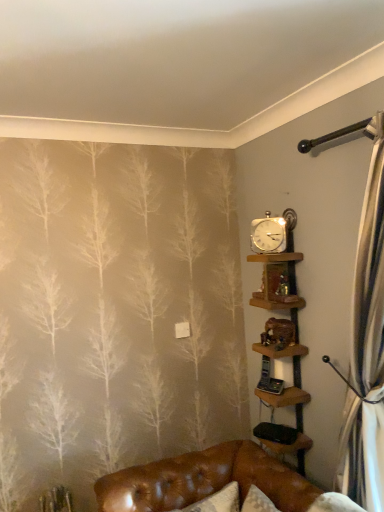
Measure the distance between point (277, 298) and camera.

A distance of 6.87 feet exists between point (277, 298) and camera.

Identify the location of wooden shelf at upper center, which appears as the 1th shelf when viewed from the top. The image size is (384, 512). (277, 281).

You are a GUI agent. You are given a task and a screenshot of the screen. Output one action in this format:
    pyautogui.click(x=<x>, y=<y>)
    Task: Click on the wooden shelves at upper right, the 1th shelf in the bottom-to-top sequence
    This screenshot has width=384, height=512.
    Given the screenshot: What is the action you would take?
    pyautogui.click(x=280, y=334)

You are a GUI agent. You are given a task and a screenshot of the screen. Output one action in this format:
    pyautogui.click(x=<x>, y=<y>)
    Task: Click on the 1st shelf positioned below the gold metallic clock at upper right (from the image's perspective)
    
    Given the screenshot: What is the action you would take?
    pyautogui.click(x=277, y=281)

Which object is further away from the camera taking this photo, gold metallic clock at upper right or wooden shelf at upper center, which appears as the 1th shelf when viewed from the top?

gold metallic clock at upper right is more distant.

Can you confirm if gold metallic clock at upper right is wider than wooden shelf at upper center, marked as the 2th shelf in a bottom-to-top arrangement?

Incorrect, the width of gold metallic clock at upper right does not surpass that of wooden shelf at upper center, marked as the 2th shelf in a bottom-to-top arrangement.

Which is closer to the camera, (268, 216) or (275, 277)?

Point (268, 216) appears to be farther away from the viewer than point (275, 277).

Is wooden shelf at upper center, which appears as the 1th shelf when viewed from the top, in front of or behind gold metallic clock at upper right in the image?

wooden shelf at upper center, which appears as the 1th shelf when viewed from the top, is in front of gold metallic clock at upper right.

Considering the relative sizes of wooden shelf at upper center, which appears as the 1th shelf when viewed from the top, and gold metallic clock at upper right in the image provided, is wooden shelf at upper center, which appears as the 1th shelf when viewed from the top, shorter than gold metallic clock at upper right?

Yes.

Does point (259, 298) lie in front of point (269, 252)?

Yes, point (259, 298) is in front of point (269, 252).

Is gold metallic clock at upper right inside wooden shelf at upper center, marked as the 2th shelf in a bottom-to-top arrangement?

No, gold metallic clock at upper right is not surrounded by wooden shelf at upper center, marked as the 2th shelf in a bottom-to-top arrangement.

From a real-world perspective, is gold metallic clock at upper right physically below wooden shelves at upper right, acting as the 2th shelf starting from the top?

Actually, gold metallic clock at upper right is physically above wooden shelves at upper right, acting as the 2th shelf starting from the top, in the real world.

Considering the sizes of objects gold metallic clock at upper right and wooden shelves at upper right, the 1th shelf in the bottom-to-top sequence, in the image provided, who is bigger, gold metallic clock at upper right or wooden shelves at upper right, the 1th shelf in the bottom-to-top sequence,?

Bigger between the two is wooden shelves at upper right, the 1th shelf in the bottom-to-top sequence.

Do you think gold metallic clock at upper right is within wooden shelves at upper right, the 1th shelf in the bottom-to-top sequence, or outside of it?

gold metallic clock at upper right is spatially situated outside wooden shelves at upper right, the 1th shelf in the bottom-to-top sequence.

Does wooden shelves at upper right, acting as the 2th shelf starting from the top, have a greater height compared to wooden shelf at upper center, marked as the 2th shelf in a bottom-to-top arrangement?

Yes.

Is wooden shelves at upper right, acting as the 2th shelf starting from the top, further to camera compared to wooden shelf at upper center, which appears as the 1th shelf when viewed from the top?

That is True.

Is wooden shelf at upper center, marked as the 2th shelf in a bottom-to-top arrangement, at the back of wooden shelves at upper right, acting as the 2th shelf starting from the top?

Absolutely, wooden shelves at upper right, acting as the 2th shelf starting from the top, is directed away from wooden shelf at upper center, marked as the 2th shelf in a bottom-to-top arrangement.

Identify the location of shelf below the wooden shelf at upper center, which appears as the 1th shelf when viewed from the top (from the image's perspective). The height and width of the screenshot is (512, 384). (280, 334).

Is point (269, 404) closer to viewer compared to point (277, 251)?

No.

In the scene shown: Is wooden shelves at upper right, the 1th shelf in the bottom-to-top sequence, at the right side of gold metallic clock at upper right?

Correct, you'll find wooden shelves at upper right, the 1th shelf in the bottom-to-top sequence, to the right of gold metallic clock at upper right.

From the image's perspective, is wooden shelves at upper right, acting as the 2th shelf starting from the top, located above or below gold metallic clock at upper right?

Clearly, from the image's perspective, wooden shelves at upper right, acting as the 2th shelf starting from the top, is below gold metallic clock at upper right.

From the picture: Is wooden shelves at upper right, acting as the 2th shelf starting from the top, inside or outside of gold metallic clock at upper right?

wooden shelves at upper right, acting as the 2th shelf starting from the top, exists outside the volume of gold metallic clock at upper right.

The height and width of the screenshot is (512, 384). I want to click on shelf on the right side of wooden shelf at upper center, which appears as the 1th shelf when viewed from the top, so click(280, 334).

From a real-world perspective, which is physically below, wooden shelf at upper center, marked as the 2th shelf in a bottom-to-top arrangement, or wooden shelves at upper right, the 1th shelf in the bottom-to-top sequence?

In real-world perspective, wooden shelves at upper right, the 1th shelf in the bottom-to-top sequence, is lower.

Is wooden shelf at upper center, marked as the 2th shelf in a bottom-to-top arrangement, looking in the opposite direction of wooden shelves at upper right, acting as the 2th shelf starting from the top?

Yes, wooden shelf at upper center, marked as the 2th shelf in a bottom-to-top arrangement, is positioned with its back facing wooden shelves at upper right, acting as the 2th shelf starting from the top.

Is wooden shelf at upper center, marked as the 2th shelf in a bottom-to-top arrangement, positioned far away from wooden shelves at upper right, the 1th shelf in the bottom-to-top sequence?

wooden shelf at upper center, marked as the 2th shelf in a bottom-to-top arrangement, is actually quite close to wooden shelves at upper right, the 1th shelf in the bottom-to-top sequence.

Locate an element on the screen. This screenshot has width=384, height=512. clock located above the wooden shelf at upper center, which appears as the 1th shelf when viewed from the top (from a real-world perspective) is located at coordinates (268, 234).

What are the coordinates of `clock located above the wooden shelf at upper center, marked as the 2th shelf in a bottom-to-top arrangement (from the image's perspective)` in the screenshot? It's located at (268, 234).

Considering their positions, is wooden shelf at upper center, marked as the 2th shelf in a bottom-to-top arrangement, positioned further to gold metallic clock at upper right than wooden shelves at upper right, acting as the 2th shelf starting from the top?

wooden shelves at upper right, acting as the 2th shelf starting from the top, is further to gold metallic clock at upper right.

Looking at the image, which one is located further to wooden shelves at upper right, acting as the 2th shelf starting from the top, wooden shelf at upper center, which appears as the 1th shelf when viewed from the top, or gold metallic clock at upper right?

gold metallic clock at upper right is further to wooden shelves at upper right, acting as the 2th shelf starting from the top.

From the image, which object appears to be farther from gold metallic clock at upper right, wooden shelves at upper right, the 1th shelf in the bottom-to-top sequence, or wooden shelf at upper center, which appears as the 1th shelf when viewed from the top?

wooden shelves at upper right, the 1th shelf in the bottom-to-top sequence, lies further to gold metallic clock at upper right than the other object.

From the image, which object appears to be farther from wooden shelf at upper center, which appears as the 1th shelf when viewed from the top, gold metallic clock at upper right or wooden shelves at upper right, acting as the 2th shelf starting from the top?

wooden shelves at upper right, acting as the 2th shelf starting from the top, lies further to wooden shelf at upper center, which appears as the 1th shelf when viewed from the top, than the other object.

Which object lies further to the anchor point wooden shelves at upper right, the 1th shelf in the bottom-to-top sequence, gold metallic clock at upper right or wooden shelf at upper center, which appears as the 1th shelf when viewed from the top?

The object further to wooden shelves at upper right, the 1th shelf in the bottom-to-top sequence, is gold metallic clock at upper right.

From the image, which object appears to be nearer to wooden shelf at upper center, marked as the 2th shelf in a bottom-to-top arrangement, wooden shelves at upper right, the 1th shelf in the bottom-to-top sequence, or gold metallic clock at upper right?

Among the two, gold metallic clock at upper right is located nearer to wooden shelf at upper center, marked as the 2th shelf in a bottom-to-top arrangement.

Where is `shelf between gold metallic clock at upper right and wooden shelves at upper right, acting as the 2th shelf starting from the top, in the up-down direction`? The image size is (384, 512). shelf between gold metallic clock at upper right and wooden shelves at upper right, acting as the 2th shelf starting from the top, in the up-down direction is located at coordinates (277, 281).